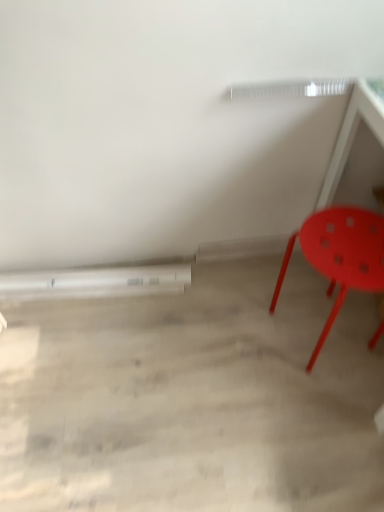
At what (x,y) coordinates should I click in order to perform the action: click on free spot behind matte plastic chair at right. Please return your answer as a coordinate pair (x, y). The height and width of the screenshot is (512, 384). Looking at the image, I should click on (285, 274).